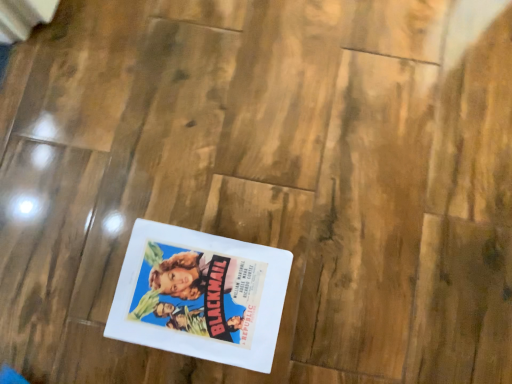
Where is `free space that is to the left of white paper at center`? free space that is to the left of white paper at center is located at coordinates (71, 281).